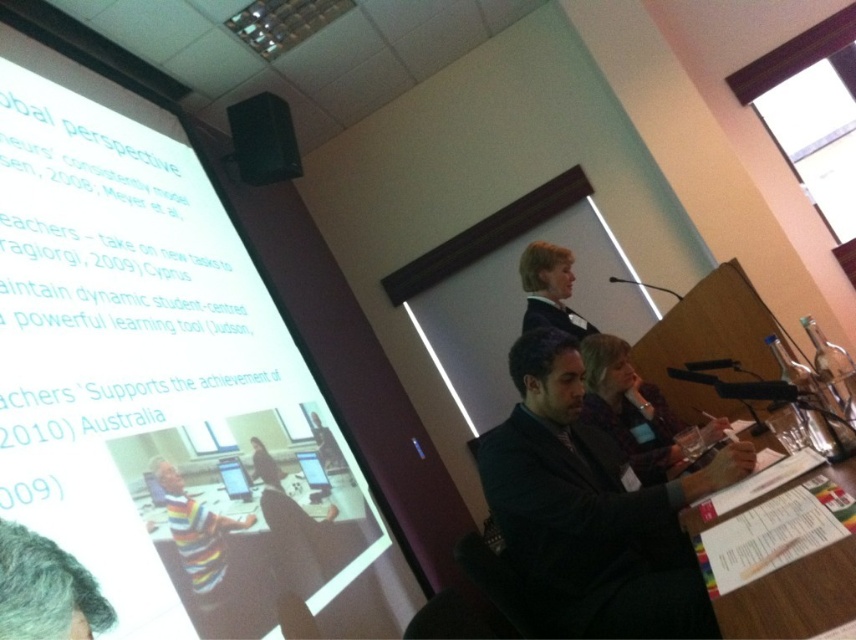
Is point (290, 161) closer to camera compared to point (522, 257)?

No, it is not.

Does point (236, 145) come farther from viewer compared to point (538, 268)?

Yes, point (236, 145) is behind point (538, 268).

Identify the location of black matte speaker at upper left. (263, 140).

Which is more to the left, wooden table at center or black fabric business suit at upper center?

wooden table at center is more to the left.

Which is more to the right, wooden table at center or black fabric business suit at upper center?

Positioned to the right is black fabric business suit at upper center.

Is point (269, 499) farther from viewer compared to point (528, 296)?

That is False.

Find the location of `wooden table at center`. wooden table at center is located at coordinates (251, 554).

In the scene shown: Does black fabric business suit at upper center have a lesser height compared to striped sweater at center?

In fact, black fabric business suit at upper center may be taller than striped sweater at center.

Can you confirm if black fabric business suit at upper center is positioned below striped sweater at center?

Incorrect, black fabric business suit at upper center is not positioned below striped sweater at center.

At what (x,y) coordinates should I click in order to perform the action: click on black fabric business suit at upper center. Please return your answer as a coordinate pair (x, y). Looking at the image, I should click on (554, 317).

Locate an element on the screen. This screenshot has width=856, height=640. black fabric business suit at upper center is located at coordinates (554, 317).